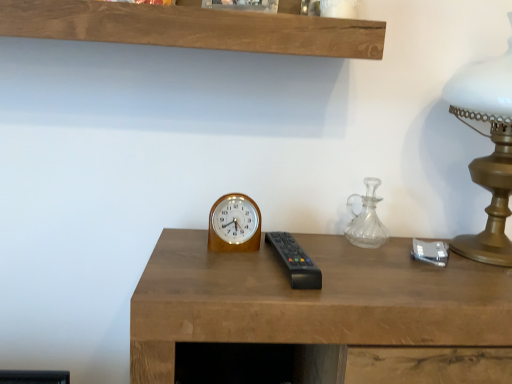
Question: Is black plastic remote at center surrounding gold metallic table lamp at right?

Choices:
 (A) yes
 (B) no

Answer: (B)

Question: From a real-world perspective, is black plastic remote at center physically below gold metallic table lamp at right?

Choices:
 (A) yes
 (B) no

Answer: (A)

Question: Is black plastic remote at center completely or partially outside of gold metallic table lamp at right?

Choices:
 (A) yes
 (B) no

Answer: (A)

Question: Considering the relative positions of black plastic remote at center and gold metallic table lamp at right in the image provided, is black plastic remote at center to the right of gold metallic table lamp at right from the viewer's perspective?

Choices:
 (A) no
 (B) yes

Answer: (A)

Question: Can you confirm if black plastic remote at center is thinner than gold metallic table lamp at right?

Choices:
 (A) yes
 (B) no

Answer: (A)

Question: Is black plastic remote at center taller than gold metallic table lamp at right?

Choices:
 (A) no
 (B) yes

Answer: (A)

Question: Is clear glass carafe at right in front of wooden wall clock at center?

Choices:
 (A) no
 (B) yes

Answer: (A)

Question: Is clear glass carafe at right with wooden wall clock at center?

Choices:
 (A) yes
 (B) no

Answer: (B)

Question: Is clear glass carafe at right positioned with its back to wooden wall clock at center?

Choices:
 (A) no
 (B) yes

Answer: (A)

Question: Can you confirm if clear glass carafe at right is bigger than wooden wall clock at center?

Choices:
 (A) no
 (B) yes

Answer: (B)

Question: Considering the relative positions of clear glass carafe at right and wooden wall clock at center in the image provided, is clear glass carafe at right to the right of wooden wall clock at center from the viewer's perspective?

Choices:
 (A) yes
 (B) no

Answer: (A)

Question: Is clear glass carafe at right outside of wooden wall clock at center?

Choices:
 (A) yes
 (B) no

Answer: (A)

Question: Is clear glass carafe at right positioned before black plastic remote at center?

Choices:
 (A) yes
 (B) no

Answer: (B)